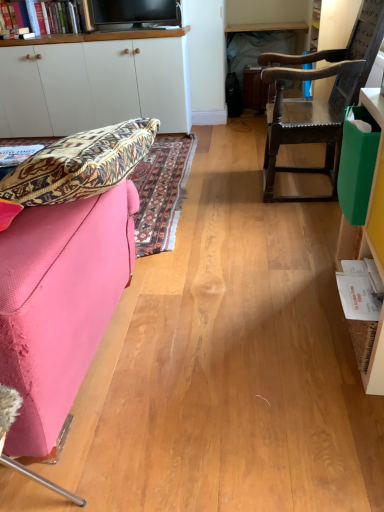
I want to click on vacant space in dark brown wooden chair at right (from a real-world perspective), so click(308, 181).